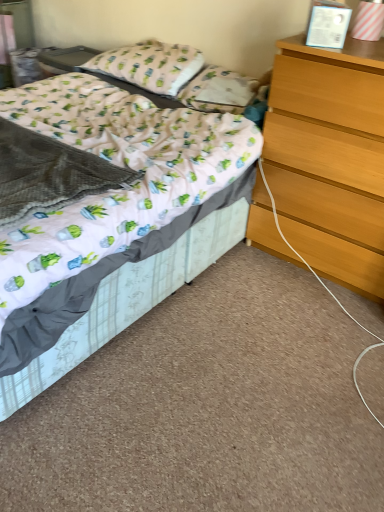
I want to click on white fabric bed at center, so click(118, 222).

What is the approximate width of white fabric bed at center?

6.49 feet.

What is the approximate width of white fabric pillow at center, the 1th pillow in the right-to-left sequence?

white fabric pillow at center, the 1th pillow in the right-to-left sequence, is 8.65 inches in width.

Measure the distance between point [294,139] and camera.

The distance of point [294,139] from camera is 5.94 feet.

Describe the element at coordinates (150, 65) in the screenshot. Image resolution: width=384 pixels, height=512 pixels. I see `white fabric pillow at upper center, the first pillow viewed from the left` at that location.

Locate an element on the screen. This screenshot has width=384, height=512. white fabric bed at center is located at coordinates (118, 222).

Is white fabric bed at center smaller than light brown wooden chest of drawers at right?

No.

Is white fabric bed at center shorter than light brown wooden chest of drawers at right?

Yes.

Find the location of `chest of drawers above the white fabric bed at center (from the image's perspective)`. chest of drawers above the white fabric bed at center (from the image's perspective) is located at coordinates (330, 157).

Can you tell me how much light brown wooden chest of drawers at right and white fabric bed at center differ in facing direction?

The angle between the facing direction of light brown wooden chest of drawers at right and the facing direction of white fabric bed at center is 0.395 degrees.

From the image's perspective, is light brown wooden chest of drawers at right on top of white fabric bed at center?

Indeed, from the image's perspective, light brown wooden chest of drawers at right is shown above white fabric bed at center.

Find the location of `chest of drawers above the white fabric bed at center (from the image's perspective)`. chest of drawers above the white fabric bed at center (from the image's perspective) is located at coordinates (330, 157).

Can you confirm if light brown wooden chest of drawers at right is wider than white fabric bed at center?

No.

From the image's perspective, is white fabric bed at center under white fabric pillow at center, positioned as the second pillow in left-to-right order?

Yes, from the image's perspective, white fabric bed at center is beneath white fabric pillow at center, positioned as the second pillow in left-to-right order.

From a real-world perspective, relative to white fabric pillow at center, positioned as the second pillow in left-to-right order, is white fabric bed at center vertically above or below?

From a real-world perspective, white fabric bed at center is physically below white fabric pillow at center, positioned as the second pillow in left-to-right order.

Which of these two, white fabric bed at center or white fabric pillow at center, the 1th pillow in the right-to-left sequence, is smaller?

white fabric pillow at center, the 1th pillow in the right-to-left sequence.

From the image's perspective, is white fabric pillow at upper center, the second pillow viewed from the right, below white fabric bed at center?

No, from the image's perspective, white fabric pillow at upper center, the second pillow viewed from the right, is not below white fabric bed at center.

Consider the image. Considering the sizes of objects white fabric pillow at upper center, the first pillow viewed from the left, and white fabric bed at center in the image provided, who is bigger, white fabric pillow at upper center, the first pillow viewed from the left, or white fabric bed at center?

Bigger between the two is white fabric bed at center.

Considering the sizes of objects white fabric pillow at upper center, the first pillow viewed from the left, and white fabric bed at center in the image provided, who is taller, white fabric pillow at upper center, the first pillow viewed from the left, or white fabric bed at center?

white fabric bed at center is taller.

In the scene shown: Is white fabric pillow at upper center, the second pillow viewed from the right, turned away from white fabric bed at center?

white fabric pillow at upper center, the second pillow viewed from the right, does not have its back to white fabric bed at center.

Is white fabric pillow at upper center, the second pillow viewed from the right, directly adjacent to light brown wooden chest of drawers at right?

No, white fabric pillow at upper center, the second pillow viewed from the right, is not making contact with light brown wooden chest of drawers at right.

This screenshot has width=384, height=512. I want to click on chest of drawers that appears on the right of white fabric pillow at upper center, the second pillow viewed from the right, so click(x=330, y=157).

Considering the sizes of objects white fabric pillow at upper center, the second pillow viewed from the right, and light brown wooden chest of drawers at right in the image provided, who is shorter, white fabric pillow at upper center, the second pillow viewed from the right, or light brown wooden chest of drawers at right?

With less height is white fabric pillow at upper center, the second pillow viewed from the right.

Is white fabric pillow at upper center, the second pillow viewed from the right, positioned beyond the bounds of light brown wooden chest of drawers at right?

white fabric pillow at upper center, the second pillow viewed from the right, lies outside light brown wooden chest of drawers at right's area.

Is light brown wooden chest of drawers at right aimed at white fabric pillow at upper center, the second pillow viewed from the right?

No.

From the image's perspective, is light brown wooden chest of drawers at right above or below white fabric pillow at upper center, the first pillow viewed from the left?

light brown wooden chest of drawers at right is situated lower than white fabric pillow at upper center, the first pillow viewed from the left, in the image.

Which of these two, light brown wooden chest of drawers at right or white fabric pillow at upper center, the first pillow viewed from the left, is wider?

light brown wooden chest of drawers at right is wider.

From the picture: Would you say white fabric pillow at upper center, the first pillow viewed from the left, is part of light brown wooden chest of drawers at right's contents?

No, white fabric pillow at upper center, the first pillow viewed from the left, is not surrounded by light brown wooden chest of drawers at right.

Does point (279, 60) appear closer or farther from the camera than point (195, 75)?

Point (279, 60).

From their relative heights in the image, would you say light brown wooden chest of drawers at right is taller or shorter than white fabric pillow at center, the 1th pillow in the right-to-left sequence?

In the image, light brown wooden chest of drawers at right appears to be taller than white fabric pillow at center, the 1th pillow in the right-to-left sequence.

Find the location of a particular element. chest of drawers below the white fabric pillow at center, the 1th pillow in the right-to-left sequence (from the image's perspective) is located at coordinates (330, 157).

From the image's perspective, is light brown wooden chest of drawers at right below white fabric pillow at center, positioned as the second pillow in left-to-right order?

Correct, light brown wooden chest of drawers at right appears lower than white fabric pillow at center, positioned as the second pillow in left-to-right order, in the image.

Image resolution: width=384 pixels, height=512 pixels. What are the coordinates of `the chest of drawers lying above the white fabric bed at center (from the image's perspective)` in the screenshot? It's located at (330, 157).

At what (x,y) coordinates should I click in order to perform the action: click on the chest of drawers that appears behind the white fabric bed at center. Please return your answer as a coordinate pair (x, y). The image size is (384, 512). Looking at the image, I should click on pos(330,157).

From the image, which object appears to be nearer to white fabric pillow at center, positioned as the second pillow in left-to-right order, white fabric bed at center or light brown wooden chest of drawers at right?

light brown wooden chest of drawers at right.

From the image, which object appears to be farther from white fabric pillow at upper center, the second pillow viewed from the right, white fabric bed at center or light brown wooden chest of drawers at right?

light brown wooden chest of drawers at right is positioned further to the anchor white fabric pillow at upper center, the second pillow viewed from the right.

Based on the photo, looking at the image, which one is located closer to white fabric pillow at upper center, the first pillow viewed from the left, light brown wooden chest of drawers at right or white fabric bed at center?

The object closer to white fabric pillow at upper center, the first pillow viewed from the left, is white fabric bed at center.

Looking at the image, which one is located further to light brown wooden chest of drawers at right, white fabric pillow at center, positioned as the second pillow in left-to-right order, or white fabric pillow at upper center, the second pillow viewed from the right?

white fabric pillow at upper center, the second pillow viewed from the right, is further to light brown wooden chest of drawers at right.

Considering their positions, is white fabric pillow at upper center, the second pillow viewed from the right, positioned further to light brown wooden chest of drawers at right than white fabric bed at center?

white fabric pillow at upper center, the second pillow viewed from the right, is further to light brown wooden chest of drawers at right.

Estimate the real-world distances between objects in this image. Which object is closer to white fabric pillow at center, positioned as the second pillow in left-to-right order, white fabric pillow at upper center, the second pillow viewed from the right, or light brown wooden chest of drawers at right?

white fabric pillow at upper center, the second pillow viewed from the right, is positioned closer to the anchor white fabric pillow at center, positioned as the second pillow in left-to-right order.

From the image, which object appears to be farther from white fabric pillow at center, the 1th pillow in the right-to-left sequence, white fabric pillow at upper center, the second pillow viewed from the right, or white fabric bed at center?

The object further to white fabric pillow at center, the 1th pillow in the right-to-left sequence, is white fabric bed at center.

Which object lies further to the anchor point light brown wooden chest of drawers at right, white fabric pillow at center, positioned as the second pillow in left-to-right order, or white fabric bed at center?

white fabric pillow at center, positioned as the second pillow in left-to-right order, is further to light brown wooden chest of drawers at right.

Locate an element on the screen. pillow situated between white fabric pillow at upper center, the second pillow viewed from the right, and light brown wooden chest of drawers at right from left to right is located at coordinates (216, 91).

Where is `pillow between white fabric bed at center and white fabric pillow at upper center, the second pillow viewed from the right, from front to back`? The width and height of the screenshot is (384, 512). pillow between white fabric bed at center and white fabric pillow at upper center, the second pillow viewed from the right, from front to back is located at coordinates point(216,91).